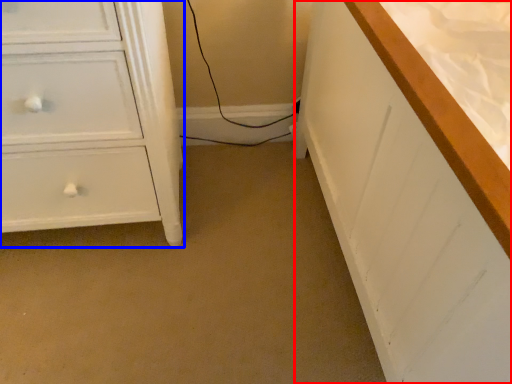
Question: Which object appears farthest to the camera in this image, counter top (highlighted by a red box) or chest of drawers (highlighted by a blue box)?

Choices:
 (A) counter top
 (B) chest of drawers

Answer: (B)